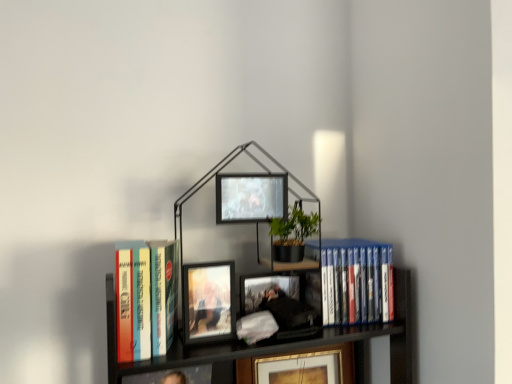
Question: Does metallic black bookcase at center come in front of matte black picture frame at center, which ranks as the 2th picture frame in back-to-front order?

Choices:
 (A) no
 (B) yes

Answer: (B)

Question: Is metallic black bookcase at center outside matte black picture frame at center, which is the first picture frame in top-to-bottom order?

Choices:
 (A) no
 (B) yes

Answer: (B)

Question: Considering the relative sizes of metallic black bookcase at center and matte black picture frame at center, which is the second picture frame from front to back, in the image provided, is metallic black bookcase at center wider than matte black picture frame at center, which is the second picture frame from front to back,?

Choices:
 (A) yes
 (B) no

Answer: (A)

Question: Is metallic black bookcase at center aimed at matte black picture frame at center, which is the second picture frame from front to back?

Choices:
 (A) yes
 (B) no

Answer: (A)

Question: Is there a large distance between metallic black bookcase at center and matte black picture frame at center, which is the second picture frame from front to back?

Choices:
 (A) yes
 (B) no

Answer: (B)

Question: Can you confirm if metallic black bookcase at center is smaller than matte black picture frame at center, marked as the 3th picture frame in a bottom-to-top arrangement?

Choices:
 (A) no
 (B) yes

Answer: (A)

Question: Is matte black picture frame at center, arranged as the third picture frame when viewed from the top, thinner than matte wooden picture frame at center, marked as the second picture frame in a bottom-to-top arrangement?

Choices:
 (A) no
 (B) yes

Answer: (A)

Question: From the image's perspective, is matte black picture frame at center, acting as the 1th picture frame starting from the back, under matte wooden picture frame at center, marked as the second picture frame in a bottom-to-top arrangement?

Choices:
 (A) yes
 (B) no

Answer: (A)

Question: Considering the relative sizes of matte black picture frame at center, acting as the 1th picture frame starting from the back, and matte wooden picture frame at center, marked as the second picture frame in a bottom-to-top arrangement, in the image provided, is matte black picture frame at center, acting as the 1th picture frame starting from the back, wider than matte wooden picture frame at center, marked as the second picture frame in a bottom-to-top arrangement,?

Choices:
 (A) no
 (B) yes

Answer: (B)

Question: From a real-world perspective, does matte black picture frame at center, acting as the 1th picture frame starting from the back, sit lower than matte wooden picture frame at center, marked as the second picture frame in a bottom-to-top arrangement?

Choices:
 (A) yes
 (B) no

Answer: (A)

Question: Does matte black picture frame at center, acting as the 1th picture frame starting from the back, appear on the left side of matte wooden picture frame at center, which appears as the first picture frame when viewed from the front?

Choices:
 (A) yes
 (B) no

Answer: (B)

Question: Is matte black picture frame at center, acting as the 1th picture frame starting from the back, positioned beyond the bounds of matte wooden picture frame at center, marked as the third picture frame in a back-to-front arrangement?

Choices:
 (A) yes
 (B) no

Answer: (A)

Question: Is matte black picture frame at center, which is the first picture frame in top-to-bottom order, next to hardcover books at left, the 2th book when ordered from back to front?

Choices:
 (A) no
 (B) yes

Answer: (A)